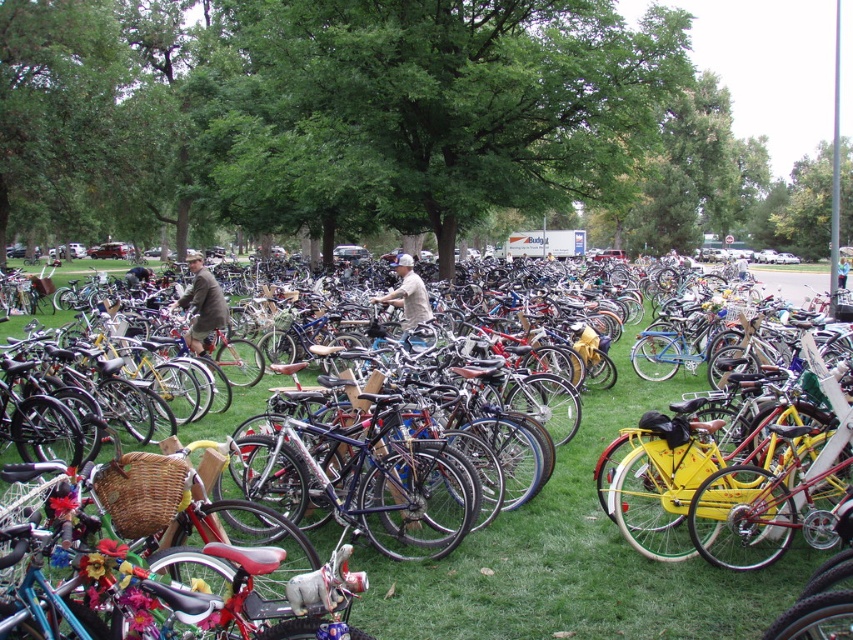
Question: From the image, what is the correct spatial relationship of brown wool coat at center in relation to beige cotton shirt at center?

Choices:
 (A) above
 (B) below

Answer: (B)

Question: Which of the following is the farthest from the observer?

Choices:
 (A) (508, 554)
 (B) (190, 349)

Answer: (B)

Question: Is green grass at center to the left of beige cotton shirt at center from the viewer's perspective?

Choices:
 (A) yes
 (B) no

Answer: (A)

Question: Does green grass at center appear over brown wool coat at center?

Choices:
 (A) yes
 (B) no

Answer: (B)

Question: Which point is closer to the camera taking this photo?

Choices:
 (A) (386, 301)
 (B) (200, 257)
 (C) (610, 634)

Answer: (C)

Question: Estimate the real-world distances between objects in this image. Which object is farther from the brown wool coat at center?

Choices:
 (A) beige cotton shirt at center
 (B) green grass at center

Answer: (B)